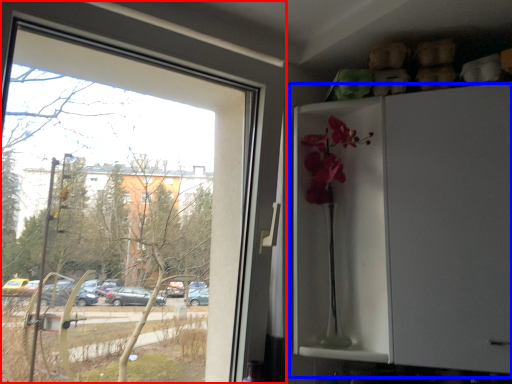
Question: Which object appears closest to the camera in this image, window (highlighted by a red box) or fridge (highlighted by a blue box)?

Choices:
 (A) window
 (B) fridge

Answer: (A)